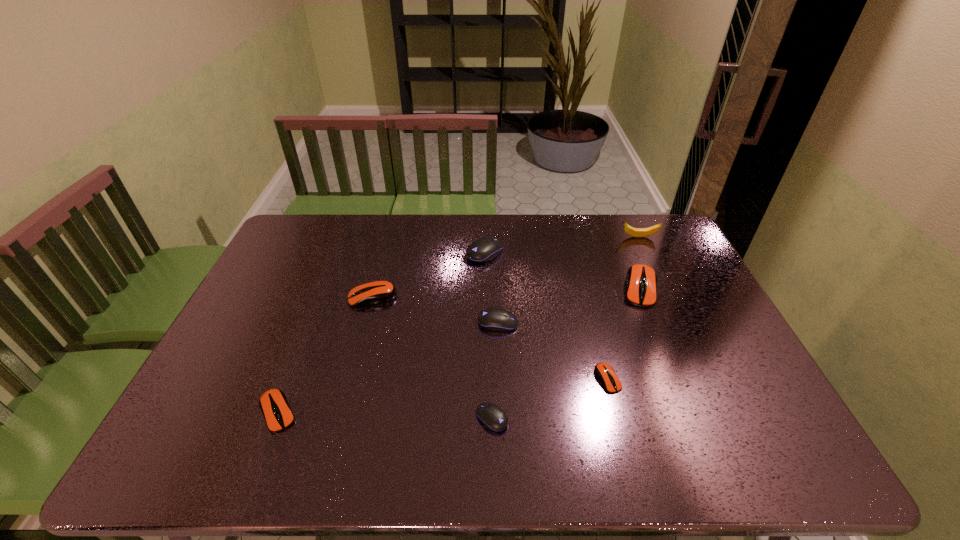
What are the coordinates of `computer mouse object that ranks as the sixth closest to the second farthest black computer mouse` in the screenshot? It's located at (273, 403).

Locate which orange computer mouse ranks second in proximity to the farthest object. Please provide its 2D coordinates. Your answer should be formatted as a tuple, i.e. [(x, y)], where the tuple contains the x and y coordinates of a point satisfying the conditions above.

[(605, 373)]

Choose which orange computer mouse is the second nearest neighbor to the second orange computer mouse from left to right. Please provide its 2D coordinates. Your answer should be formatted as a tuple, i.e. [(x, y)], where the tuple contains the x and y coordinates of a point satisfying the conditions above.

[(605, 373)]

The width and height of the screenshot is (960, 540). I want to click on black computer mouse that can be found as the second closest to the sixth object from left to right, so click(493, 417).

In order to click on black computer mouse that is the nearest to the rightmost computer mouse in this screenshot , I will do [494, 319].

Where is `vacant space that satisfies the following two spatial constraints: 1. on the back side of the leftmost computer mouse; 2. on the left side of the smallest orange computer mouse`? vacant space that satisfies the following two spatial constraints: 1. on the back side of the leftmost computer mouse; 2. on the left side of the smallest orange computer mouse is located at coordinates (291, 379).

Where is `free location that satisfies the following two spatial constraints: 1. on the front side of the farthest black computer mouse; 2. on the left side of the nearest black computer mouse`? free location that satisfies the following two spatial constraints: 1. on the front side of the farthest black computer mouse; 2. on the left side of the nearest black computer mouse is located at coordinates (487, 418).